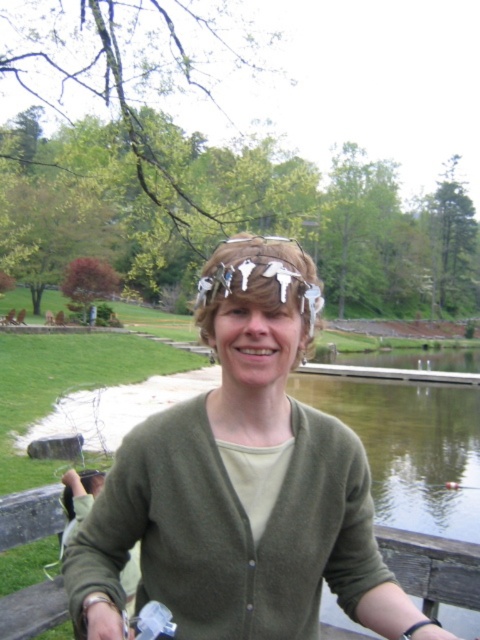
Which is below, matte green cardigan at center or brown matte hair at center?

matte green cardigan at center is below.

Based on the photo, between matte green cardigan at center and brown matte hair at center, which one appears on the left side from the viewer's perspective?

brown matte hair at center is more to the left.

Does point (266, 579) come behind point (218, 252)?

No.

Locate an element on the screen. Image resolution: width=480 pixels, height=640 pixels. matte green cardigan at center is located at coordinates (241, 483).